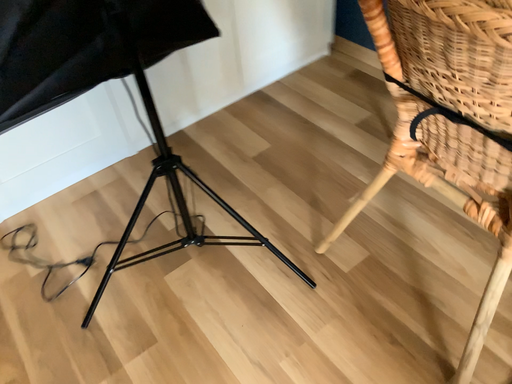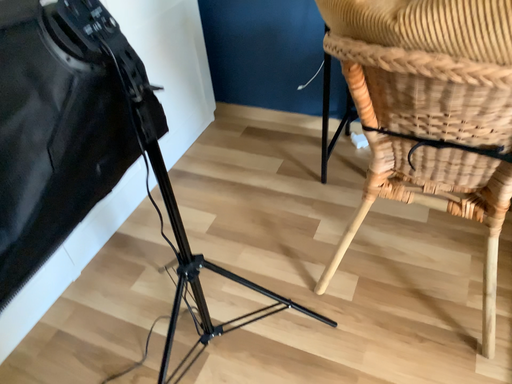
Question: Which way did the camera rotate in the video?

Choices:
 (A) rotated right
 (B) rotated left

Answer: (A)